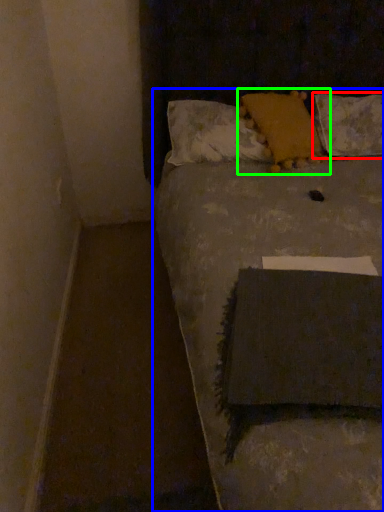
Question: Considering the real-world distances, which object is farthest from pillow (highlighted by a red box)? furniture (highlighted by a blue box) or pillow (highlighted by a green box)?

Choices:
 (A) furniture
 (B) pillow

Answer: (A)